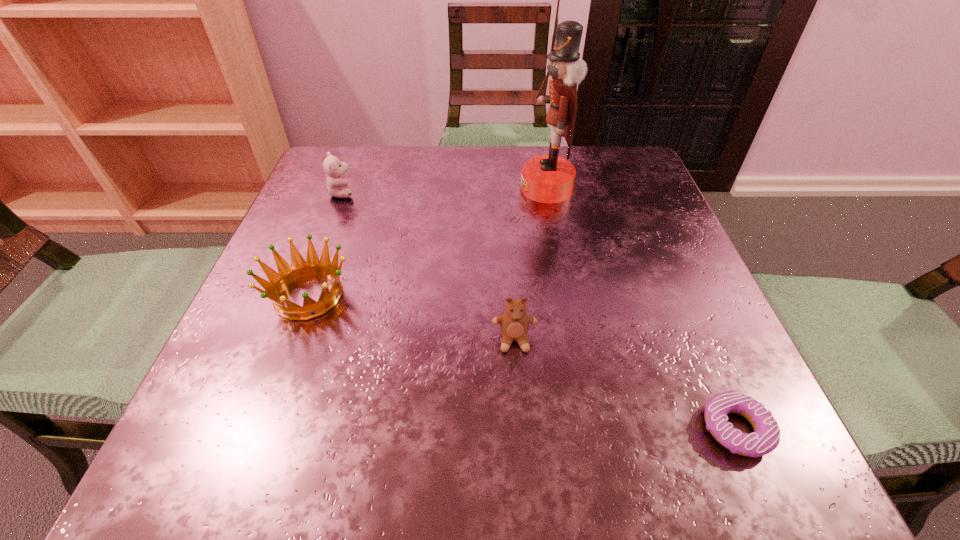
Locate an element on the screen. This screenshot has height=540, width=960. object that is at the right edge is located at coordinates (766, 436).

You are a GUI agent. You are given a task and a screenshot of the screen. Output one action in this format:
    pyautogui.click(x=<x>, y=<y>)
    Task: Click on the object that is at the far left corner
    The height and width of the screenshot is (540, 960).
    Given the screenshot: What is the action you would take?
    pyautogui.click(x=335, y=170)

Where is `object situated at the near right corner`? The image size is (960, 540). object situated at the near right corner is located at coordinates (766, 436).

In the image, there is a desktop. Identify the location of free region at the far edge. (433, 172).

This screenshot has height=540, width=960. I want to click on vacant space at the near edge of the desktop, so click(x=348, y=478).

Locate an element on the screen. vacant space at the left edge of the desktop is located at coordinates (213, 404).

In the image, there is a desktop. In order to click on vacant space at the right edge in this screenshot , I will do coord(658,353).

Where is `vacant space at the far left corner`? The height and width of the screenshot is (540, 960). vacant space at the far left corner is located at coordinates (325, 193).

Image resolution: width=960 pixels, height=540 pixels. I want to click on blank area at the near left corner, so 202,457.

Where is `free space at the far right corner`? The width and height of the screenshot is (960, 540). free space at the far right corner is located at coordinates (588, 168).